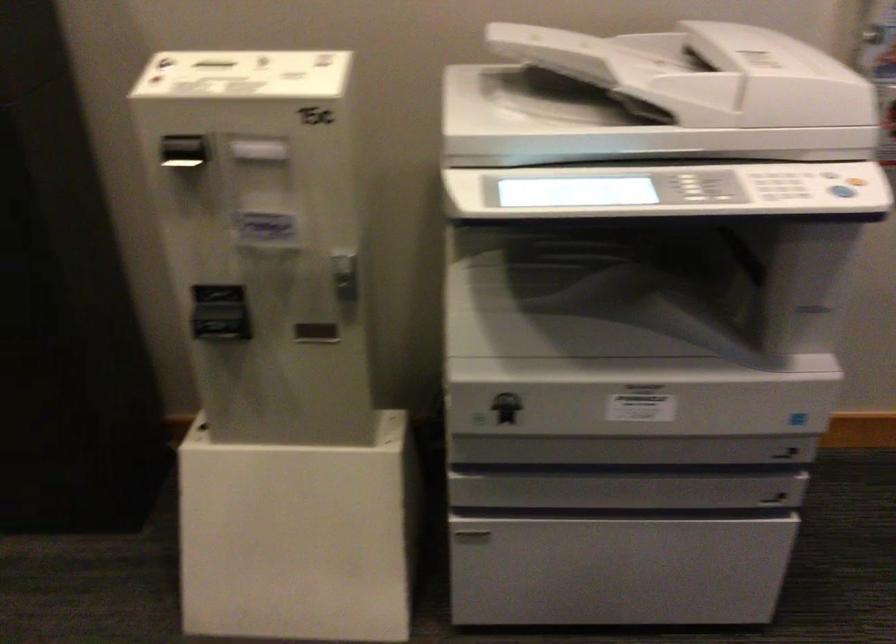
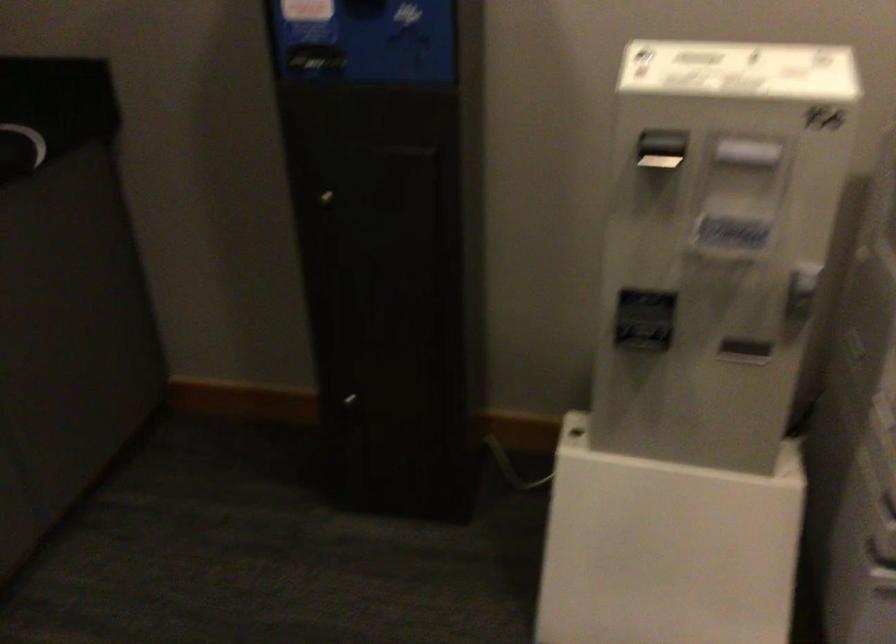
Question: The first image is from the beginning of the video and the second image is from the end. How did the camera likely rotate when shooting the video?

Choices:
 (A) Left
 (B) Right
 (C) Up
 (D) Down

Answer: (A)